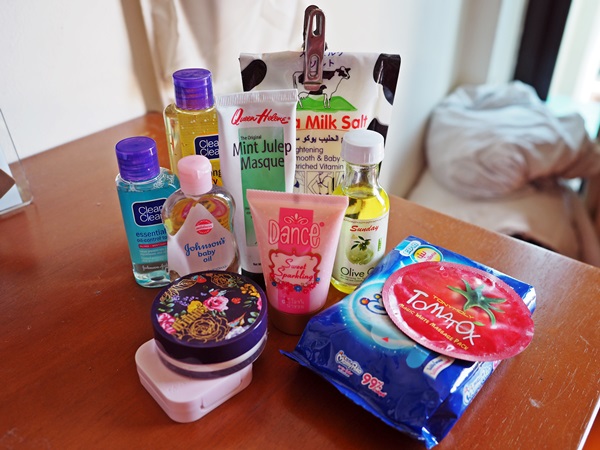
Locate an element on the screen. The width and height of the screenshot is (600, 450). bottle is located at coordinates (380, 217), (197, 231), (199, 132), (143, 210).